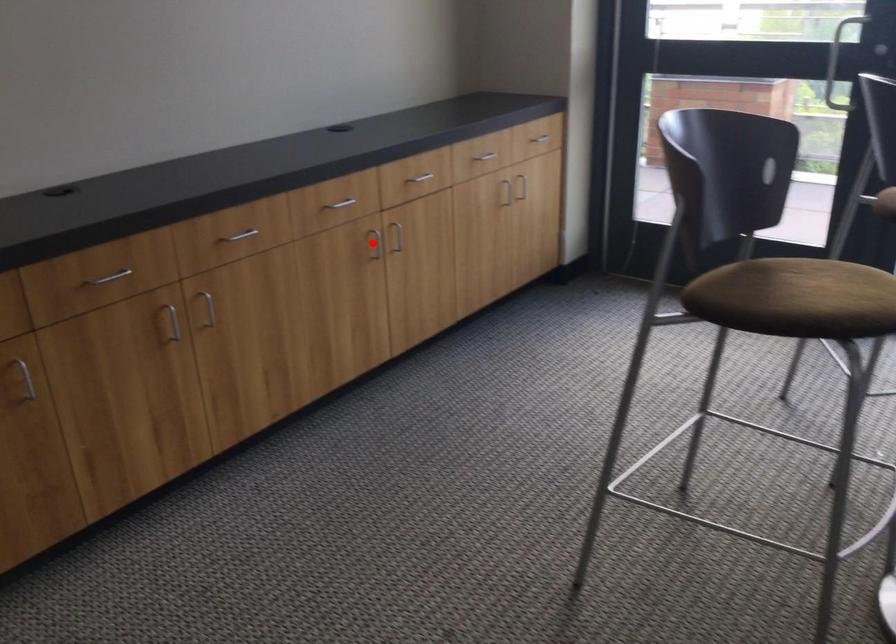
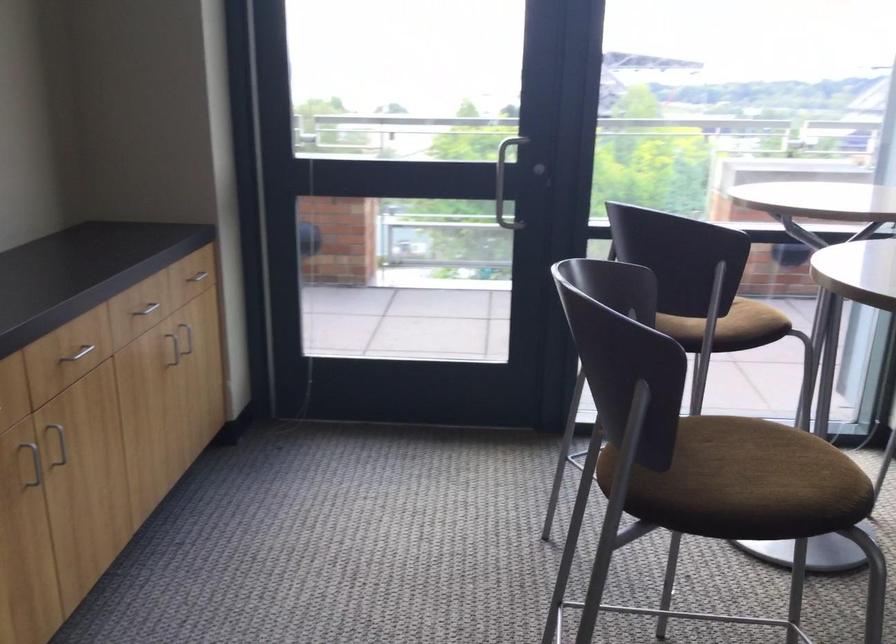
Question: I am providing you with two images of the same scene from different viewpoints. Image1 has a red point marked. In image2, the corresponding 3D location appears at what relative position? Reply with the corresponding letter.

Choices:
 (A) Closer
 (B) Farther

Answer: (A)